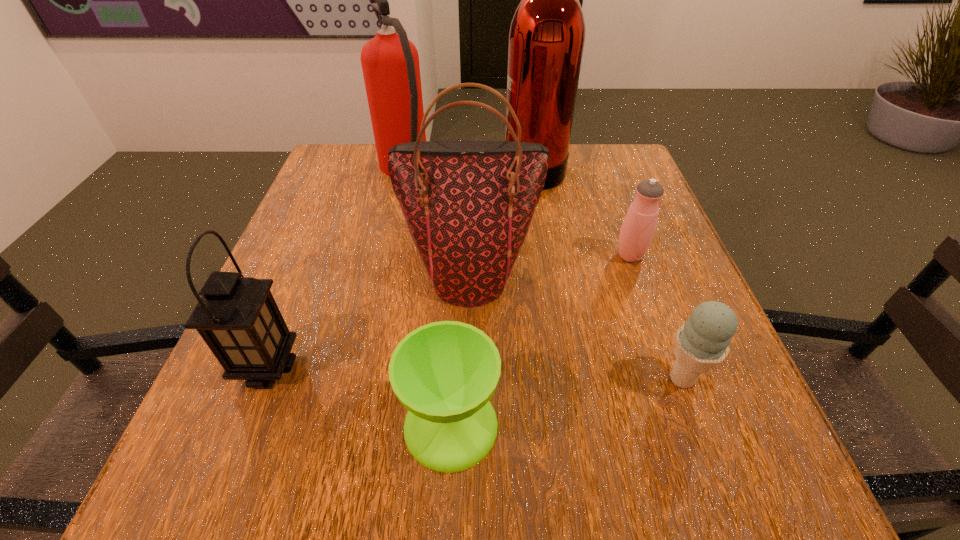
The width and height of the screenshot is (960, 540). Identify the location of thermos bottle that is at the right edge. (639, 225).

At what (x,y) coordinates should I click in order to perform the action: click on ice cream that is at the right edge. Please return your answer as a coordinate pair (x, y). Looking at the image, I should click on (701, 343).

This screenshot has width=960, height=540. Identify the location of object that is at the far left corner. tap(390, 62).

What are the coordinates of `vacant space at the near edge of the desktop` in the screenshot? It's located at (388, 456).

In the image, there is a desktop. At what (x,y) coordinates should I click in order to perform the action: click on free space at the left edge. Please return your answer as a coordinate pair (x, y). The width and height of the screenshot is (960, 540). Looking at the image, I should click on point(330,266).

At what (x,y) coordinates should I click in order to perform the action: click on free space at the right edge of the desktop. Please return your answer as a coordinate pair (x, y). The width and height of the screenshot is (960, 540). Looking at the image, I should click on (665, 255).

Locate an element on the screen. vacant space at the far left corner of the desktop is located at coordinates (359, 143).

This screenshot has height=540, width=960. In the image, there is a desktop. In order to click on vacant space at the far right corner in this screenshot , I will do `click(623, 193)`.

You are a GUI agent. You are given a task and a screenshot of the screen. Output one action in this format:
    pyautogui.click(x=<x>, y=<y>)
    Task: Click on the vacant point located between the left fire extinguisher and the ice cream
    The height and width of the screenshot is (540, 960).
    Given the screenshot: What is the action you would take?
    pyautogui.click(x=543, y=275)

The height and width of the screenshot is (540, 960). Identify the location of free space between the thermos bottle and the wineglass. (540, 340).